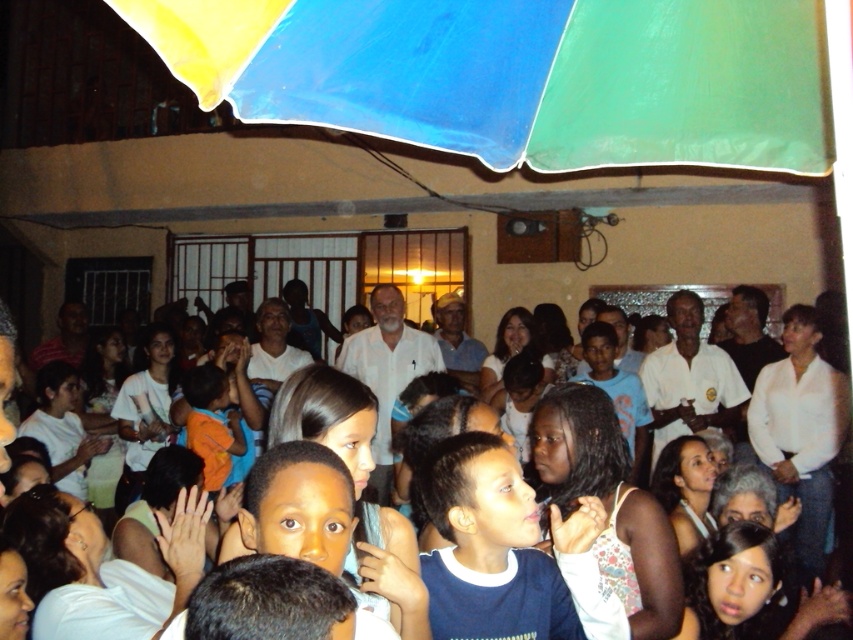
You are at a community event and want to take a photo of the white cotton crowd at center. To ensure the entire crowd is visible, should you stand under the polyester umbrella at upper center or move to a position where the umbrella is not blocking your view?

You should move to a position where the polyester umbrella at upper center is not blocking your view. Since the polyester umbrella at upper center is positioned over the white cotton crowd at center, standing under the umbrella might obstruct your view of the entire crowd.

You are at a community event and want to take a photo of the white cotton crowd at center under the polyester umbrella at upper center. To ensure the umbrella covers the crowd in the photo, should you position yourself to the left or right of the crowd?

The polyester umbrella at upper center is to the left of the white cotton crowd at center. To ensure the umbrella covers the crowd in the photo, you should position yourself to the right of the crowd so that the umbrella, which is on the left side, can be framed over them.